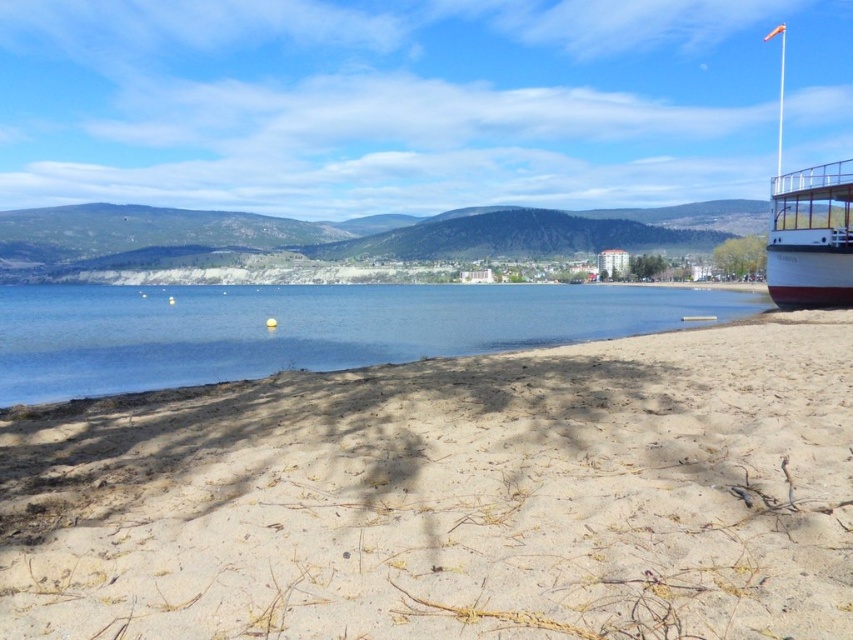
What do you see at coordinates (451, 499) in the screenshot?
I see `light brown sandy beach at lower center` at bounding box center [451, 499].

Who is taller, light brown sandy beach at lower center or clear blue water at center?

clear blue water at center

The width and height of the screenshot is (853, 640). Describe the element at coordinates (451, 499) in the screenshot. I see `light brown sandy beach at lower center` at that location.

Locate an element on the screen. This screenshot has width=853, height=640. light brown sandy beach at lower center is located at coordinates (451, 499).

Does clear blue water at center have a greater width compared to white polished wood boat at right?

Yes.

Who is more forward, [430,326] or [776,220]?

Point [430,326] is more forward.

You are a GUI agent. You are given a task and a screenshot of the screen. Output one action in this format:
    pyautogui.click(x=<x>, y=<y>)
    Task: Click on the clear blue water at center
    This screenshot has height=640, width=853.
    Given the screenshot: What is the action you would take?
    pyautogui.click(x=305, y=328)

Is light brown sandy beach at lower center to the left of white polished wood boat at right from the viewer's perspective?

Yes, light brown sandy beach at lower center is to the left of white polished wood boat at right.

Where is `light brown sandy beach at lower center`? light brown sandy beach at lower center is located at coordinates (451, 499).

At what (x,y) coordinates should I click in order to perform the action: click on light brown sandy beach at lower center. Please return your answer as a coordinate pair (x, y). The image size is (853, 640). Looking at the image, I should click on (451, 499).